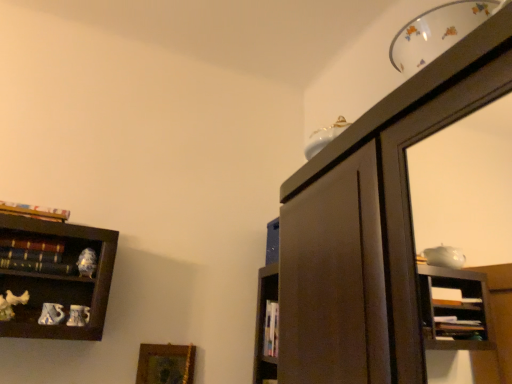
Question: Is hardcover books at left, the 2th book when ordered from top to bottom, to the right of gold-framed picture at lower left from the viewer's perspective?

Choices:
 (A) no
 (B) yes

Answer: (A)

Question: Are hardcover books at left, the 2th book when ordered from top to bottom, and gold-framed picture at lower left far apart?

Choices:
 (A) no
 (B) yes

Answer: (A)

Question: Is the position of hardcover books at left, the 2th book when ordered from top to bottom, more distant than that of gold-framed picture at lower left?

Choices:
 (A) yes
 (B) no

Answer: (B)

Question: From a real-world perspective, is hardcover books at left, the 2th book when ordered from top to bottom, below gold-framed picture at lower left?

Choices:
 (A) yes
 (B) no

Answer: (B)

Question: Is hardcover books at left, positioned as the 1th book in bottom-to-top order, facing towards gold-framed picture at lower left?

Choices:
 (A) yes
 (B) no

Answer: (B)

Question: Are hardcover books at left, the 2th book when ordered from top to bottom, and gold-framed picture at lower left making contact?

Choices:
 (A) no
 (B) yes

Answer: (A)

Question: Is gold-framed picture at lower left to the left of hardcover book at upper left, which is the 2th book from bottom to top, from the viewer's perspective?

Choices:
 (A) no
 (B) yes

Answer: (A)

Question: Is gold-framed picture at lower left bigger than hardcover book at upper left, positioned as the first book in top-to-bottom order?

Choices:
 (A) no
 (B) yes

Answer: (B)

Question: Is gold-framed picture at lower left positioned with its back to hardcover book at upper left, positioned as the first book in top-to-bottom order?

Choices:
 (A) no
 (B) yes

Answer: (A)

Question: Is the position of gold-framed picture at lower left more distant than that of hardcover book at upper left, positioned as the first book in top-to-bottom order?

Choices:
 (A) no
 (B) yes

Answer: (B)

Question: Is gold-framed picture at lower left closer to camera compared to hardcover book at upper left, positioned as the first book in top-to-bottom order?

Choices:
 (A) yes
 (B) no

Answer: (B)

Question: Would you say gold-framed picture at lower left is outside hardcover book at upper left, positioned as the first book in top-to-bottom order?

Choices:
 (A) yes
 (B) no

Answer: (A)

Question: Is hardcover book at upper left, which is the 2th book from bottom to top, surrounded by hardcover books at left, the 2th book when ordered from top to bottom?

Choices:
 (A) no
 (B) yes

Answer: (A)